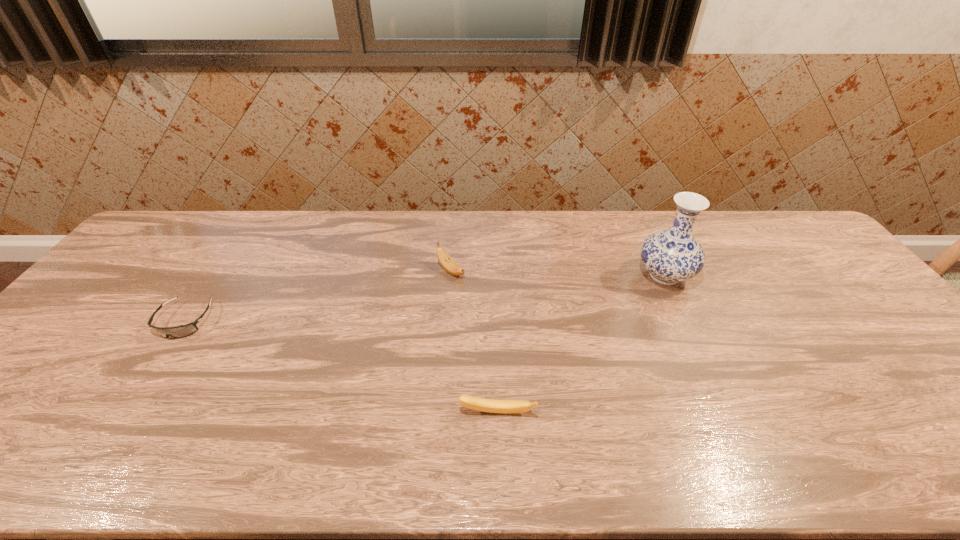
The image size is (960, 540). Identify the location of unoccupied position between the vase and the farther banana. (558, 273).

The height and width of the screenshot is (540, 960). I want to click on free space between the farther banana and the nearest object, so click(x=474, y=342).

Identify the location of empty location between the nearest object and the shortest object. Image resolution: width=960 pixels, height=540 pixels. (341, 367).

You are a GUI agent. You are given a task and a screenshot of the screen. Output one action in this format:
    pyautogui.click(x=<x>, y=<y>)
    Task: Click on the vacant space in between the farther banana and the leftmost object
    Image resolution: width=960 pixels, height=540 pixels.
    Given the screenshot: What is the action you would take?
    pyautogui.click(x=318, y=296)

Find the location of a particular element. This screenshot has width=960, height=540. vacant area between the second nearest object and the rightmost object is located at coordinates (425, 298).

The image size is (960, 540). I want to click on object that is the closest to the rightmost object, so click(x=475, y=403).

The width and height of the screenshot is (960, 540). I want to click on object that can be found as the third closest to the nearer banana, so click(x=181, y=331).

At what (x,y) coordinates should I click in order to perform the action: click on vacant area in the image that satisfies the following two spatial constraints: 1. on the front side of the farther banana; 2. on the left side of the vase. Please return your answer as a coordinate pair (x, y). Looking at the image, I should click on tap(450, 276).